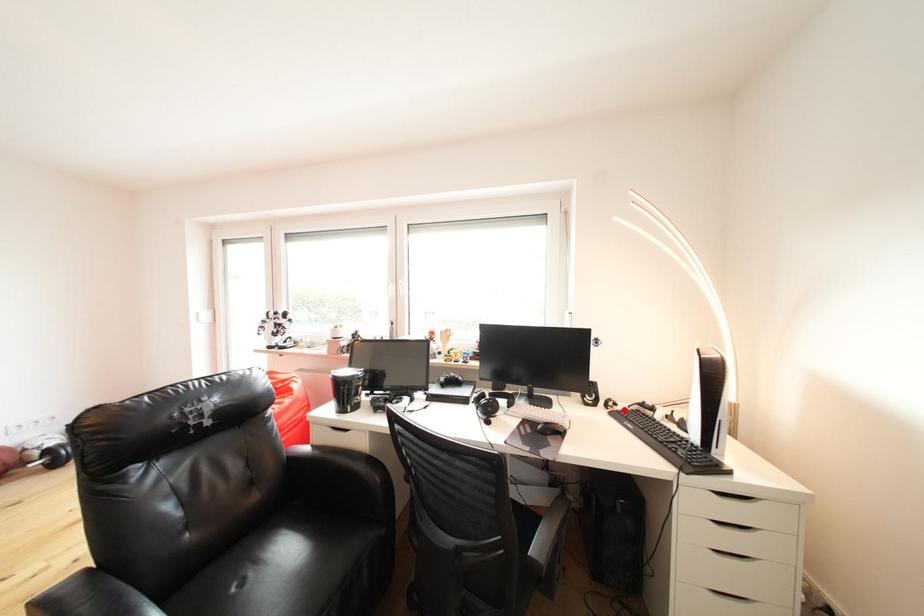
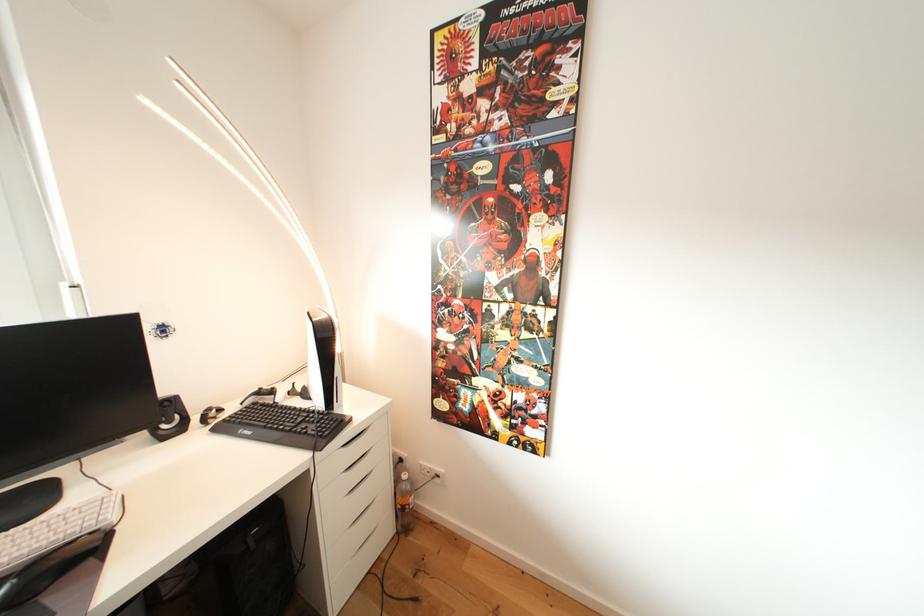
Where in the second image is the point corresponding to the highlighted location from the first image?

(228, 415)